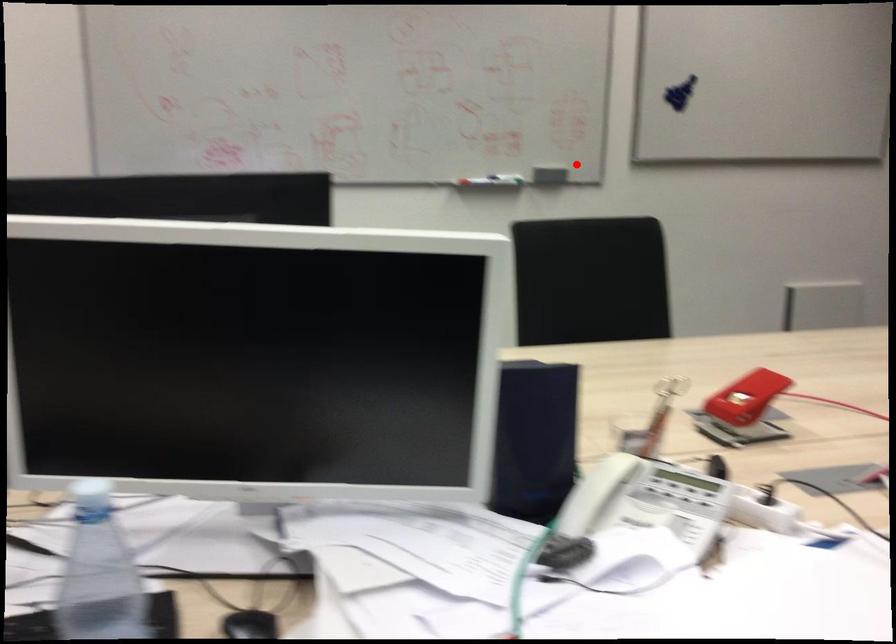
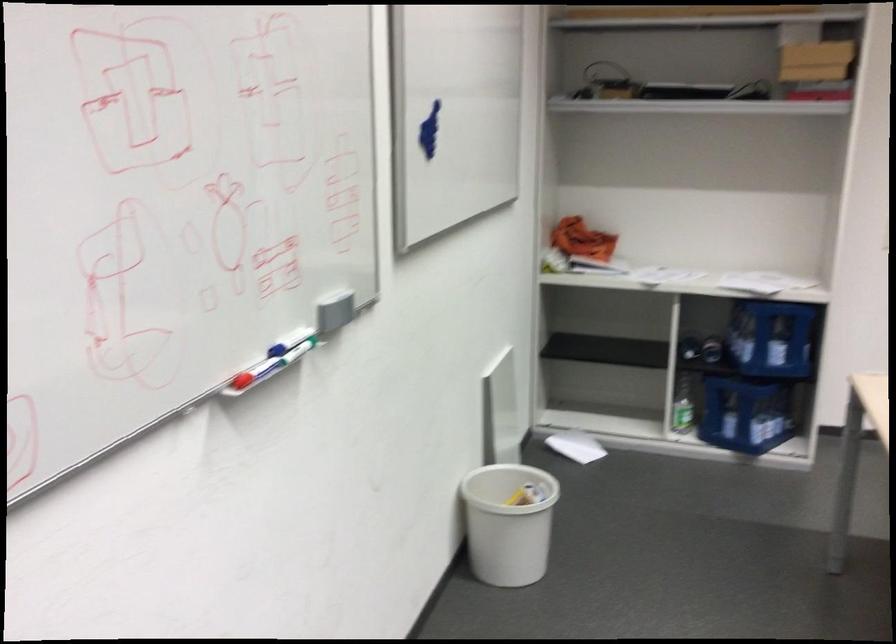
In the second image, find the point that corresponds to the highlighted location in the first image.

(334, 310)